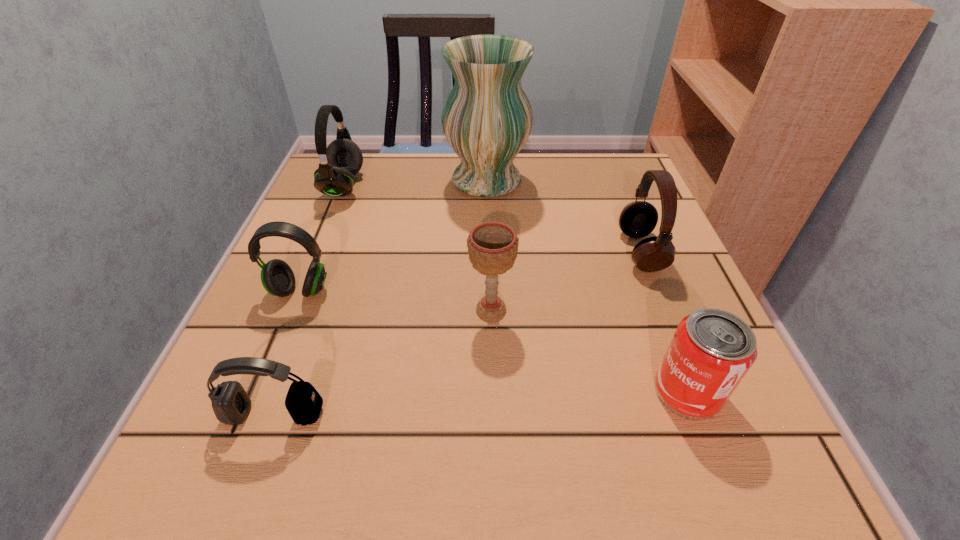
Locate an element on the screen. Image resolution: width=960 pixels, height=540 pixels. vase is located at coordinates (487, 118).

Where is `the farthest headset`? This screenshot has width=960, height=540. the farthest headset is located at coordinates (339, 162).

Find the location of a particular element. The image size is (960, 540). the rightmost headset is located at coordinates (638, 219).

Where is `chalice`? chalice is located at coordinates (492, 246).

The height and width of the screenshot is (540, 960). In order to click on can in this screenshot , I will do coord(712,350).

Locate an element on the screen. This screenshot has height=540, width=960. the nearest headset is located at coordinates (231, 404).

Identify the location of free space located on the right of the tallest object. (562, 180).

The width and height of the screenshot is (960, 540). Find the location of `free location located on the ear cups of the farthest headset`. free location located on the ear cups of the farthest headset is located at coordinates (397, 186).

Image resolution: width=960 pixels, height=540 pixels. What are the coordinates of `vacant point located 0.190m on the ear pads of the rightmost headset` in the screenshot? It's located at (524, 251).

You are a GUI agent. You are given a task and a screenshot of the screen. Output one action in this format:
    pyautogui.click(x=<x>, y=<y>)
    Task: Click on the free space located 0.320m on the ear pads of the rightmost headset
    
    Given the screenshot: What is the action you would take?
    pyautogui.click(x=458, y=251)